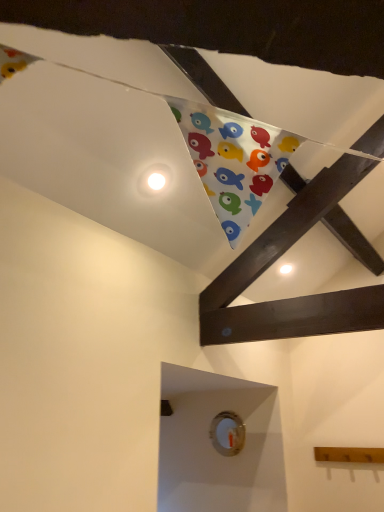
Question: Visually, is white matte button at upper center, which is counted as the 1th button, starting from the front, positioned to the left or to the right of white plastic button at lower center, acting as the second button starting from the top?

Choices:
 (A) left
 (B) right

Answer: (A)

Question: From a real-world perspective, is white matte button at upper center, placed as the 2th button when sorted from back to front, positioned above or below white plastic button at lower center, the 1th button in the back-to-front sequence?

Choices:
 (A) above
 (B) below

Answer: (A)

Question: Considering the positions of white matte button at upper center, which is the second button in right-to-left order, and white plastic button at lower center, acting as the second button starting from the top, in the image, is white matte button at upper center, which is the second button in right-to-left order, taller or shorter than white plastic button at lower center, acting as the second button starting from the top,?

Choices:
 (A) tall
 (B) short

Answer: (B)

Question: Considering their positions, is white plastic button at lower center, the 1th button in the back-to-front sequence, located in front of or behind white matte button at upper center, the second button from the bottom?

Choices:
 (A) behind
 (B) front

Answer: (A)

Question: In terms of width, does white plastic button at lower center, positioned as the 1th button in right-to-left order, look wider or thinner when compared to white matte button at upper center, which is the second button in right-to-left order?

Choices:
 (A) wide
 (B) thin

Answer: (B)

Question: Choose the correct answer: Is white plastic button at lower center, positioned as the 1th button in right-to-left order, inside white matte button at upper center, which is the second button in right-to-left order, or outside it?

Choices:
 (A) outside
 (B) inside

Answer: (A)

Question: Considering the positions of point tap(228, 436) and point tap(137, 184), is point tap(228, 436) closer or farther from the camera than point tap(137, 184)?

Choices:
 (A) closer
 (B) farther

Answer: (B)